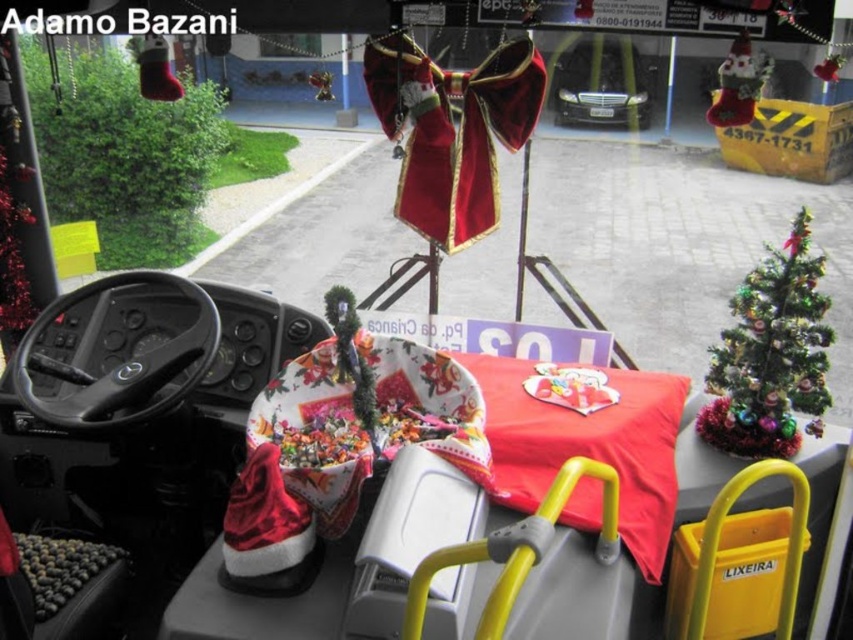
Does point (775, 371) lie in front of point (619, 108)?

Yes, point (775, 371) is in front of point (619, 108).

Does green artificial christmas tree at right have a larger size compared to glossy black car at center?

No.

Is point (785, 340) in front of point (556, 72)?

Yes, it is in front of point (556, 72).

Find the location of a particular element. The image size is (853, 640). green artificial christmas tree at right is located at coordinates (770, 355).